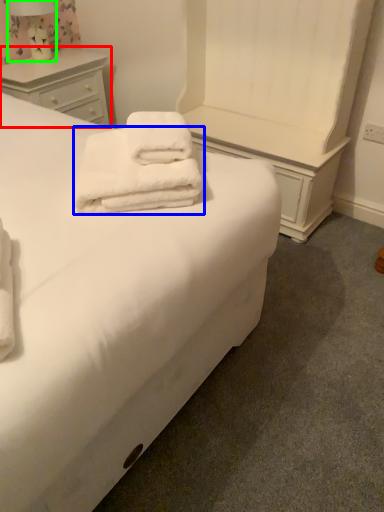
Question: Which is nearer to the chest of drawers (highlighted by a red box)? towel (highlighted by a blue box) or bedside lamp (highlighted by a green box).

Choices:
 (A) towel
 (B) bedside lamp

Answer: (B)